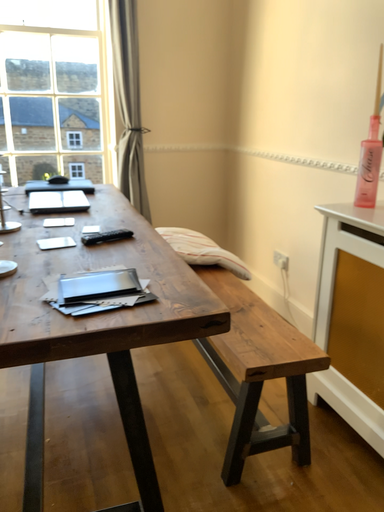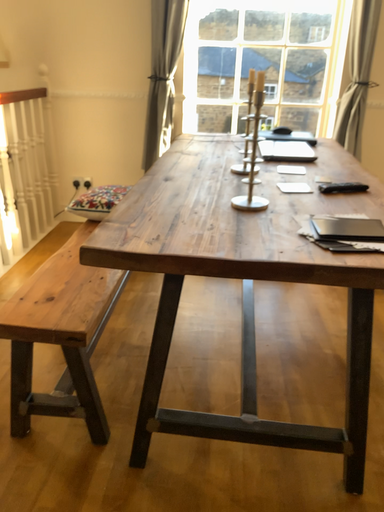
Question: How did the camera likely rotate when shooting the video?

Choices:
 (A) rotated right
 (B) rotated left

Answer: (B)